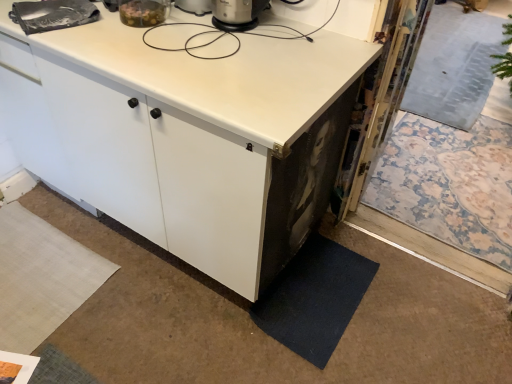
Question: From a real-world perspective, is white matte cabinet at center positioned above or below white matte countertop at upper center?

Choices:
 (A) below
 (B) above

Answer: (A)

Question: Considering the positions of white matte cabinet at center and white matte countertop at upper center in the image, is white matte cabinet at center bigger or smaller than white matte countertop at upper center?

Choices:
 (A) big
 (B) small

Answer: (A)

Question: Which of these objects is positioned closest to the white matte cabinet at center?

Choices:
 (A) dark blue carpet at lower right
 (B) white matte countertop at upper center

Answer: (B)

Question: Based on their relative distances, which object is nearer to the dark blue carpet at lower right?

Choices:
 (A) white matte countertop at upper center
 (B) white matte cabinet at center

Answer: (B)